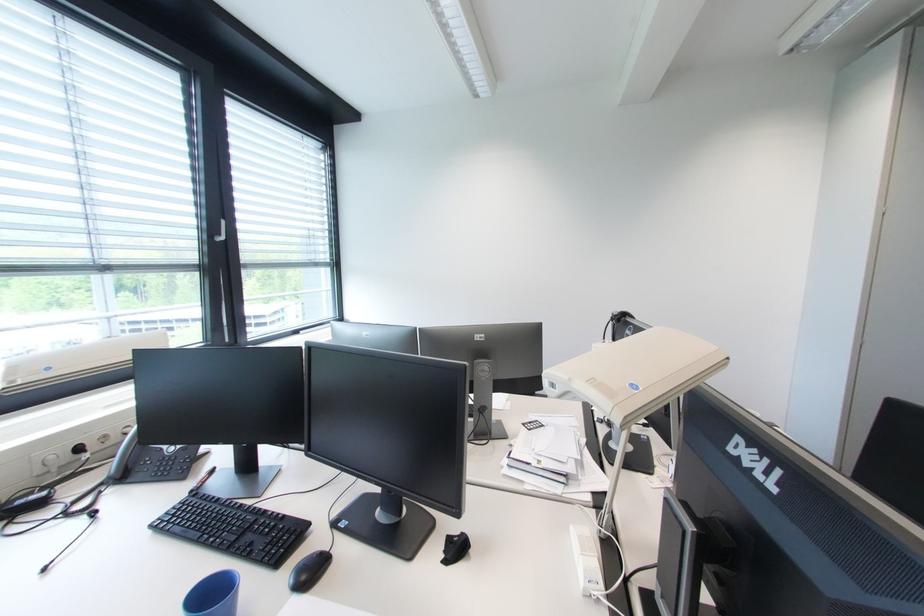
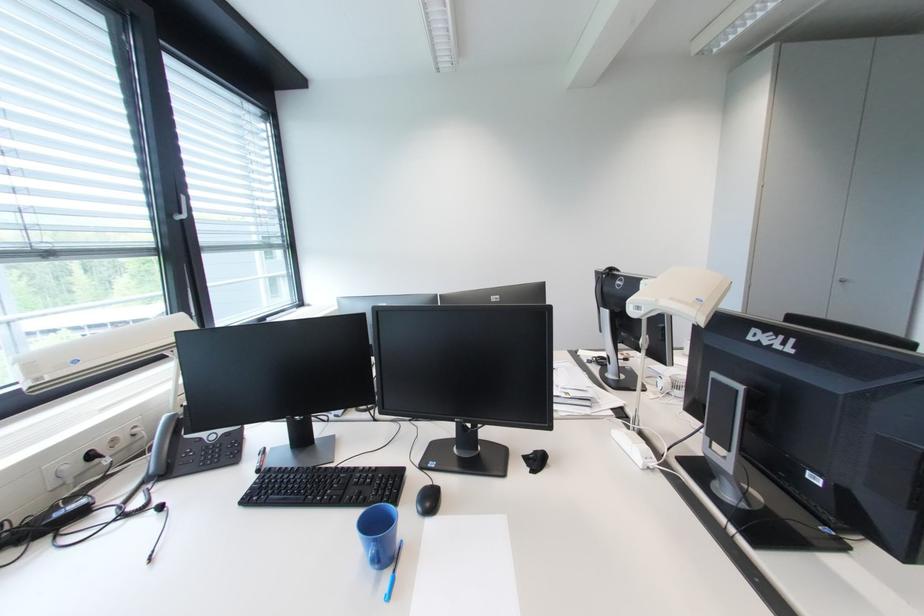
The point at (226,237) is marked in the first image. Where is the corresponding point in the second image?

(188, 215)